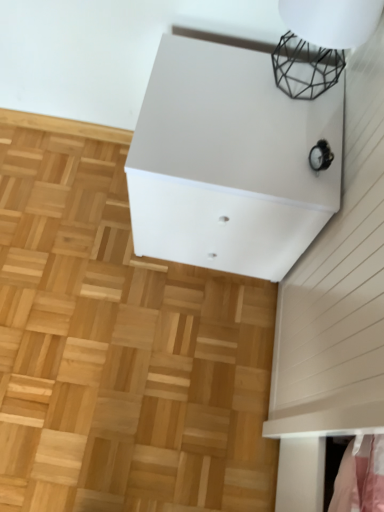
The height and width of the screenshot is (512, 384). I want to click on vacant space underneath black wire mesh at upper right (from a real-world perspective), so click(303, 81).